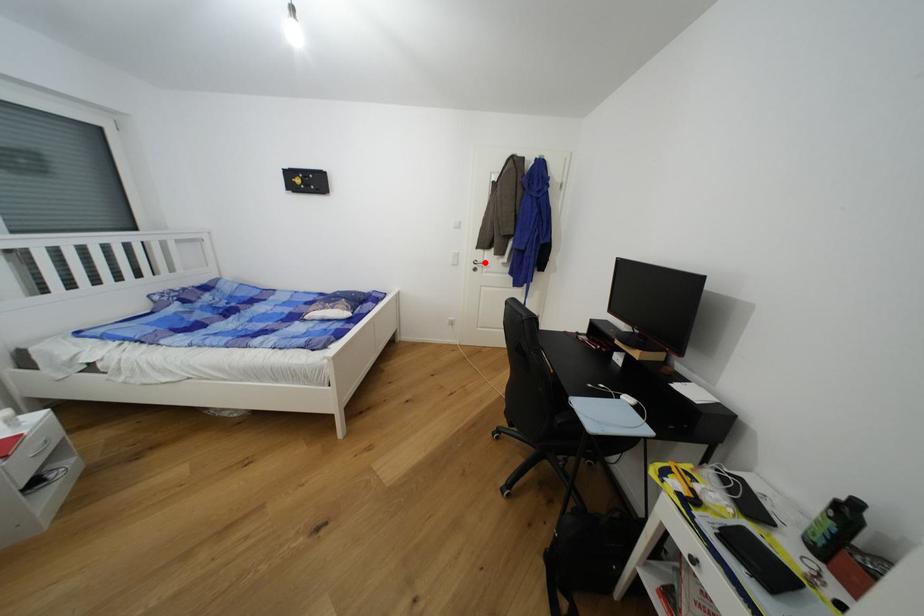
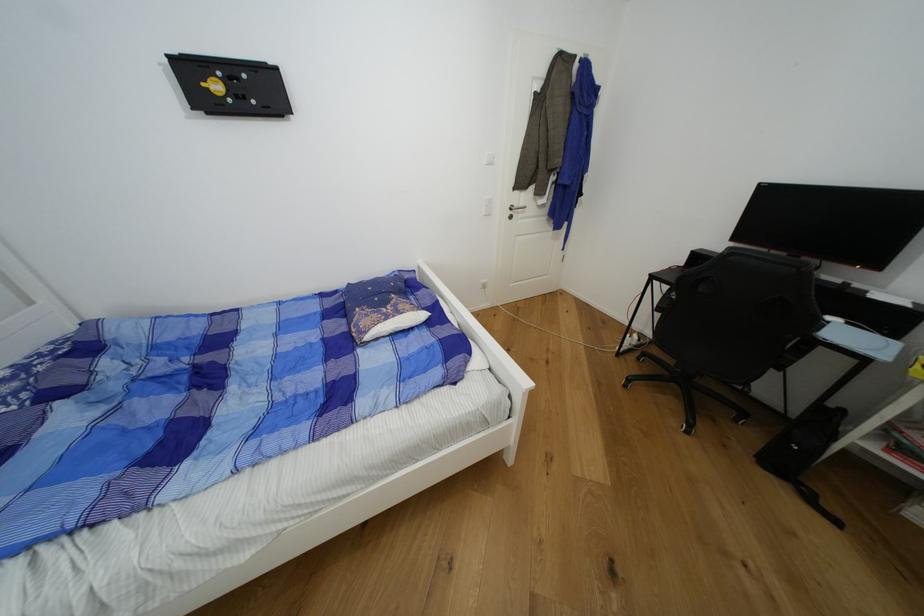
In the second image, find the point that corresponds to the highlighted location in the first image.

(521, 207)